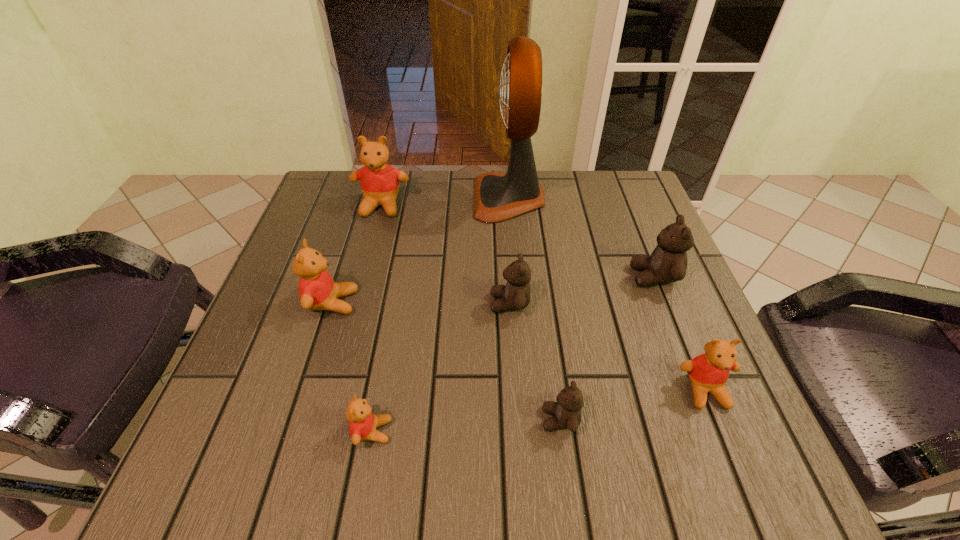
Identify the location of free area in between the second smallest red teddy bear and the tallest object. This screenshot has width=960, height=540. (607, 294).

Where is `vacant point located between the tallest object and the leftmost brown teddy bear`? This screenshot has height=540, width=960. vacant point located between the tallest object and the leftmost brown teddy bear is located at coordinates (510, 251).

I want to click on vacant region between the farthest red teddy bear and the biggest brown teddy bear, so click(x=517, y=241).

Locate an element on the screen. empty location between the rightmost brown teddy bear and the rightmost red teddy bear is located at coordinates (680, 334).

Find the location of a particular element. The height and width of the screenshot is (540, 960). empty space that is in between the second biggest red teddy bear and the second brown teddy bear from right to left is located at coordinates 446,361.

Choose which object is the nearest neighbor to the smallest red teddy bear. Please provide its 2D coordinates. Your answer should be formatted as a tuple, i.e. [(x, y)], where the tuple contains the x and y coordinates of a point satisfying the conditions above.

[(317, 290)]

This screenshot has height=540, width=960. What are the coordinates of `object that is the seventh closest to the rightmost red teddy bear` in the screenshot? It's located at (379, 181).

Select which teddy bear appears as the fourth closest to the biggest brown teddy bear. Please provide its 2D coordinates. Your answer should be formatted as a tuple, i.e. [(x, y)], where the tuple contains the x and y coordinates of a point satisfying the conditions above.

[(379, 181)]

Locate an element on the screen. This screenshot has width=960, height=540. teddy bear that stands as the sixth closest to the smallest red teddy bear is located at coordinates point(668,262).

The height and width of the screenshot is (540, 960). I want to click on red teddy bear object that ranks as the closest to the brown fan, so click(379, 181).